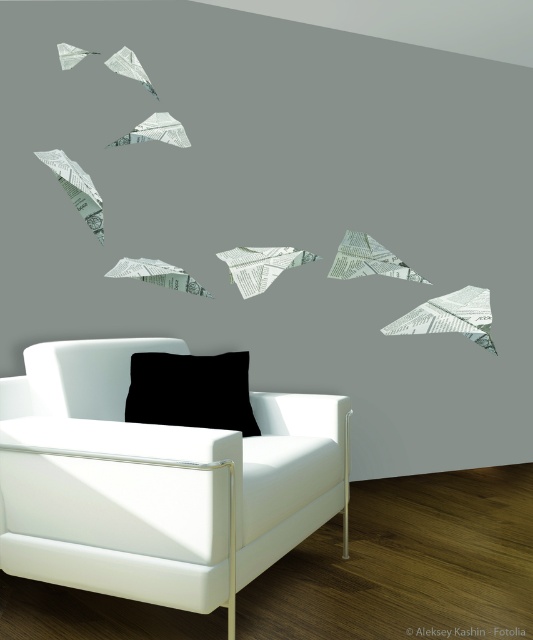
Does white leather armchair at lower left lie behind black matte pillow at lower center?

That is False.

Who is lower down, white leather armchair at lower left or black matte pillow at lower center?

white leather armchair at lower left is lower down.

At what (x,y) coordinates should I click in order to perform the action: click on white leather armchair at lower left. Please return your answer as a coordinate pair (x, y). Looking at the image, I should click on (157, 481).

Where is `white leather armchair at lower left`? white leather armchair at lower left is located at coordinates (157, 481).